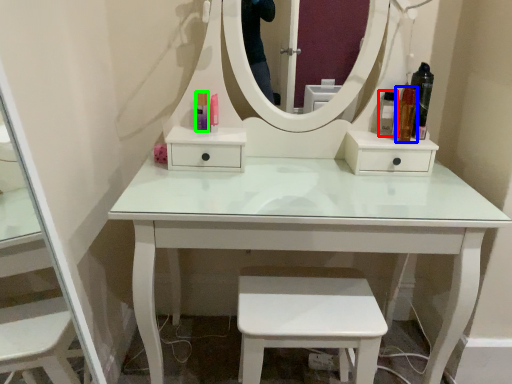
Question: Considering the real-world distances, which object is closest to toiletry (highlighted by a red box)? toiletry (highlighted by a blue box) or toiletry (highlighted by a green box).

Choices:
 (A) toiletry
 (B) toiletry

Answer: (A)